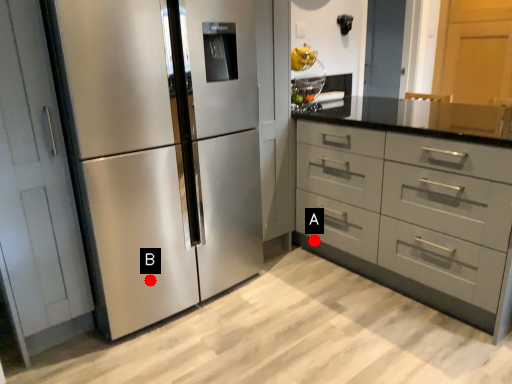
Question: Two points are circled on the image, labeled by A and B beside each circle. Which point is farther to the camera?

Choices:
 (A) A is further
 (B) B is further

Answer: (A)